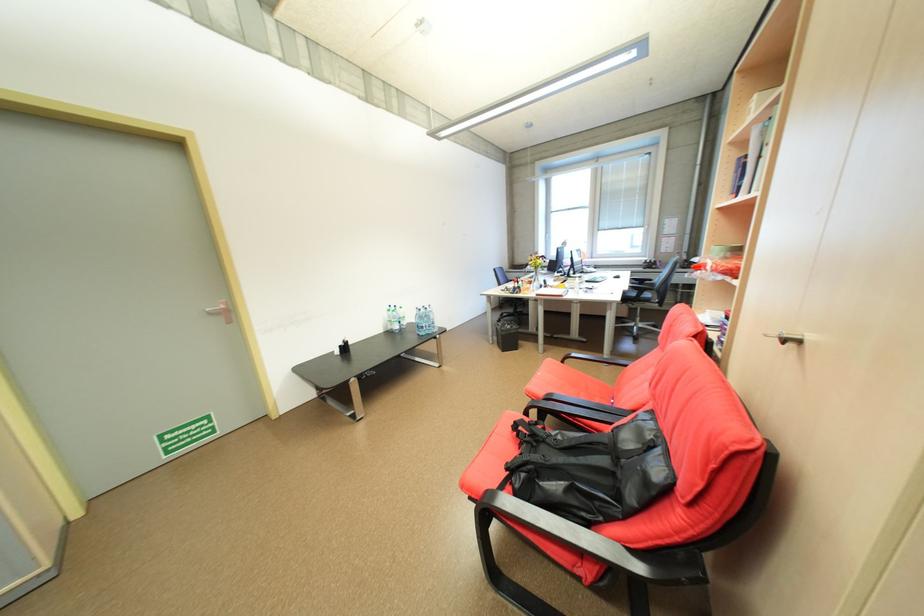
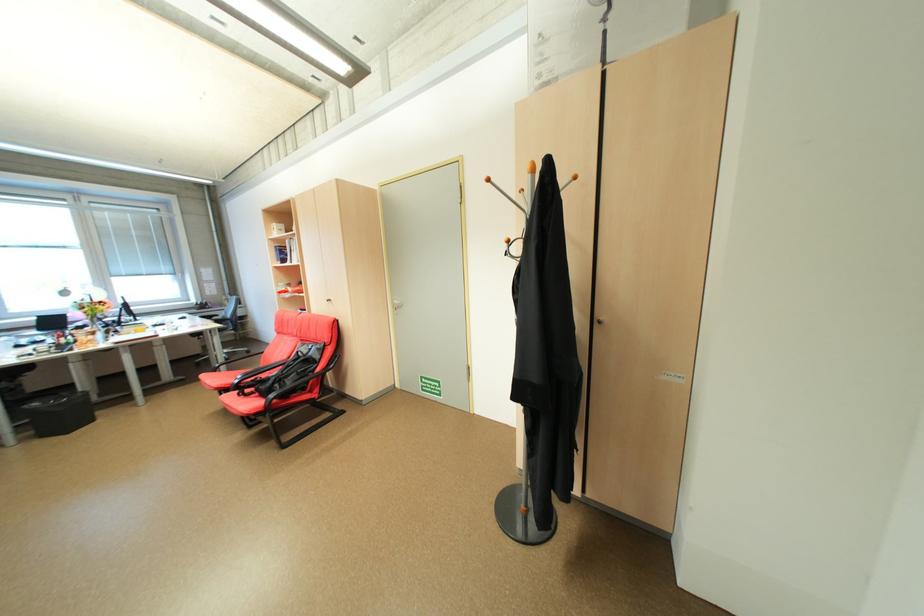
Where in the second image is the point corresponding to [532,476] from the first image?

(286, 386)